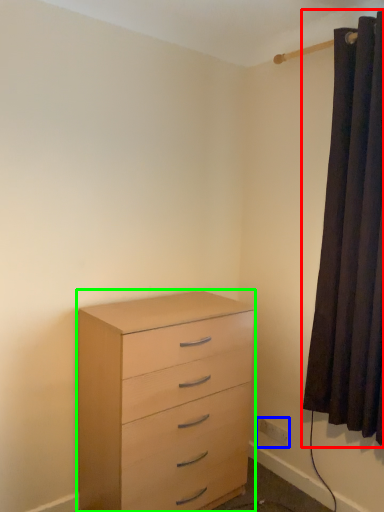
Question: Which is farther away from curtain (highlighted by a red box)? electric outlet (highlighted by a blue box) or chest of drawers (highlighted by a green box)?

Choices:
 (A) electric outlet
 (B) chest of drawers

Answer: (A)